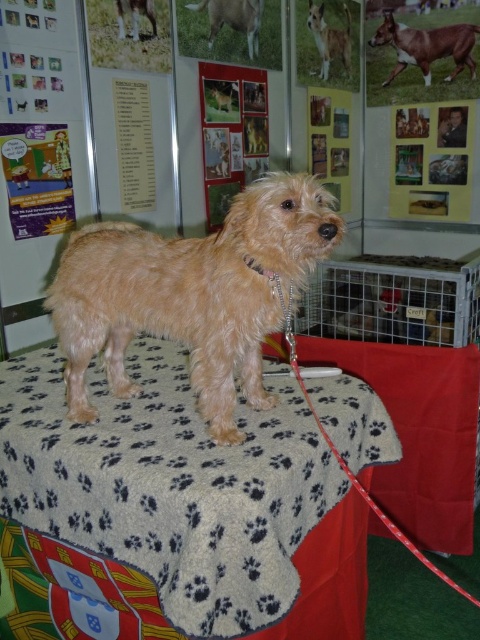
Question: Which point is farther to the camera?

Choices:
 (A) wooden frame at upper right
 (B) shiny brown dog at center
 (C) white paper at upper center

Answer: (A)

Question: Does wooden frame at upper center have a greater width compared to brown fur dog at upper right?

Choices:
 (A) no
 (B) yes

Answer: (A)

Question: Where is wooden frame at upper center located in relation to brown furry dog at upper center in the image?

Choices:
 (A) above
 (B) below

Answer: (B)

Question: Which of these objects is positioned closest to the wooden frame at upper center?

Choices:
 (A) fuzzy brown dog at center
 (B) wooden frame at upper right
 (C) brown furry dog at upper center
 (D) gray paw print fabric at center

Answer: (B)

Question: Does wooden frame at upper right have a lesser width compared to wooden frame at upper center?

Choices:
 (A) no
 (B) yes

Answer: (A)

Question: Which is nearer to the metallic silver frame at upper center?

Choices:
 (A) matte paper poster at upper left
 (B) fuzzy brown dog at center
 (C) brown furry dog at upper center
 (D) paw print fabric table at center

Answer: (C)